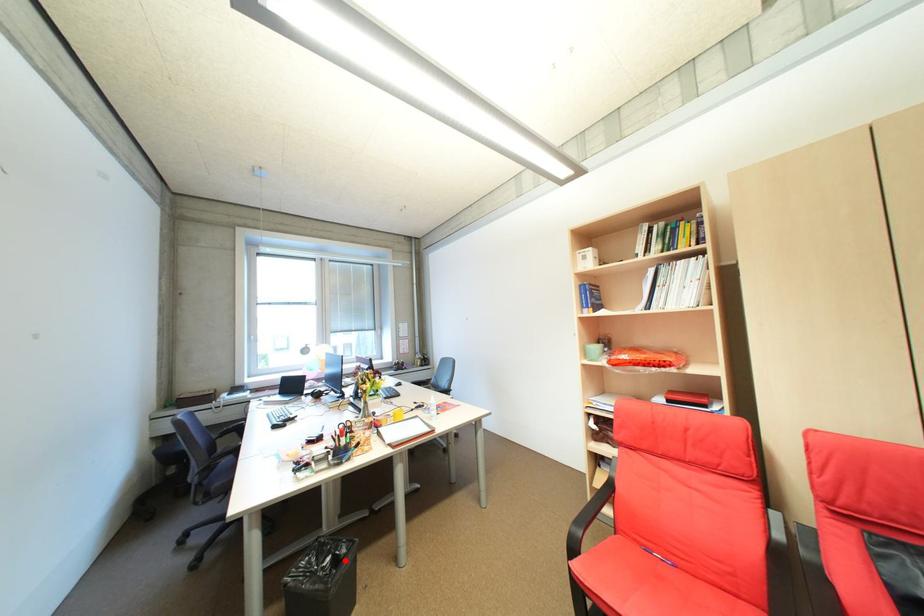
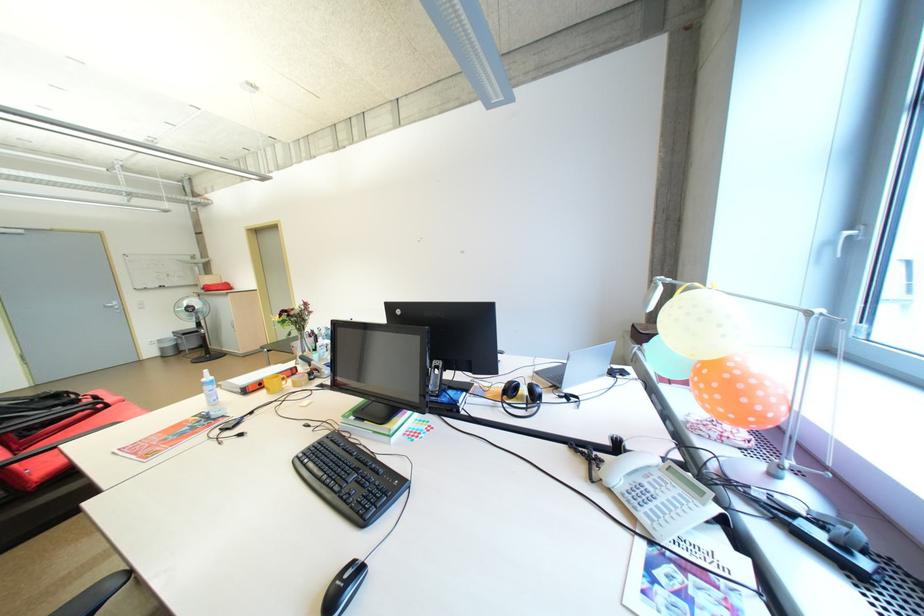
Question: I am providing you with two images of the same scene from different viewpoints. A red point is marked on the first image. Is the red point's position out of view in image 2?

Choices:
 (A) Yes
 (B) No

Answer: (A)